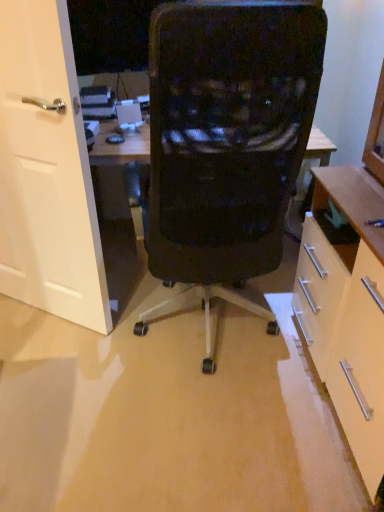
This screenshot has width=384, height=512. Find the location of `free space in front of white matte door at left`. free space in front of white matte door at left is located at coordinates (48, 361).